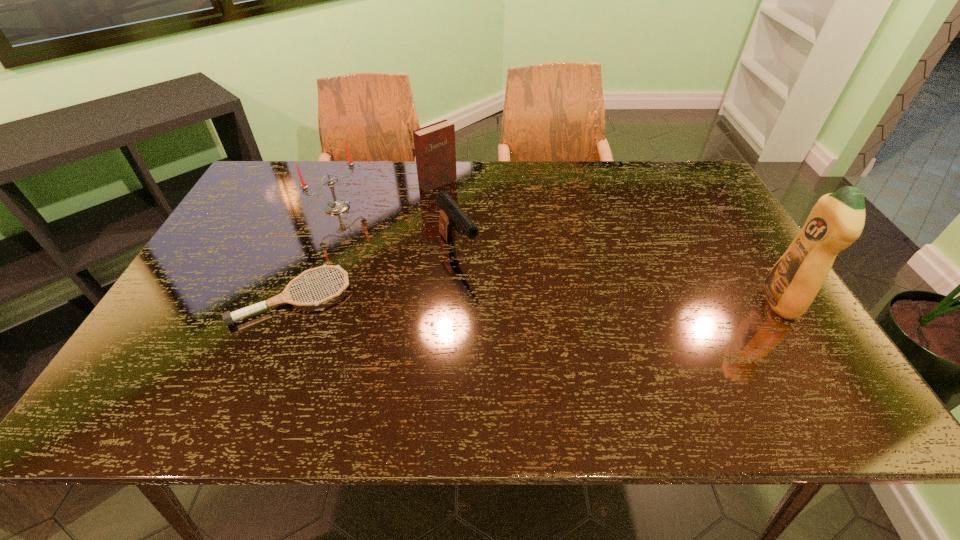
Identify the location of vacant spot on the desktop that is between the shortest object and the tallest object and is positioned at the barrel of the pistol. (495, 299).

Where is `free spot on the desktop that is between the tennis racket and the tallest object and is positioned on the front-facing side of the candle`? This screenshot has width=960, height=540. free spot on the desktop that is between the tennis racket and the tallest object and is positioned on the front-facing side of the candle is located at coordinates (492, 299).

I want to click on free space on the desktop that is between the shortest object and the detergent and is positioned on the front cover of the diary, so click(590, 300).